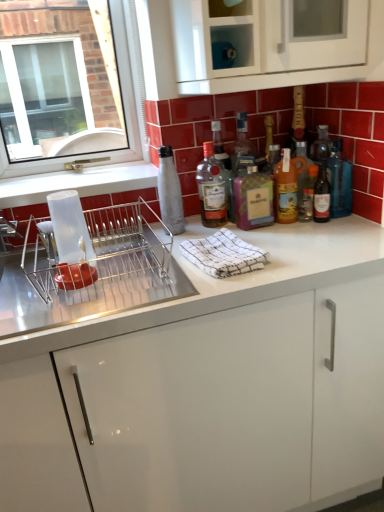
I want to click on space that is in front of matte glass bottle at center, the 3th bottle in the left-to-right sequence, so click(x=292, y=245).